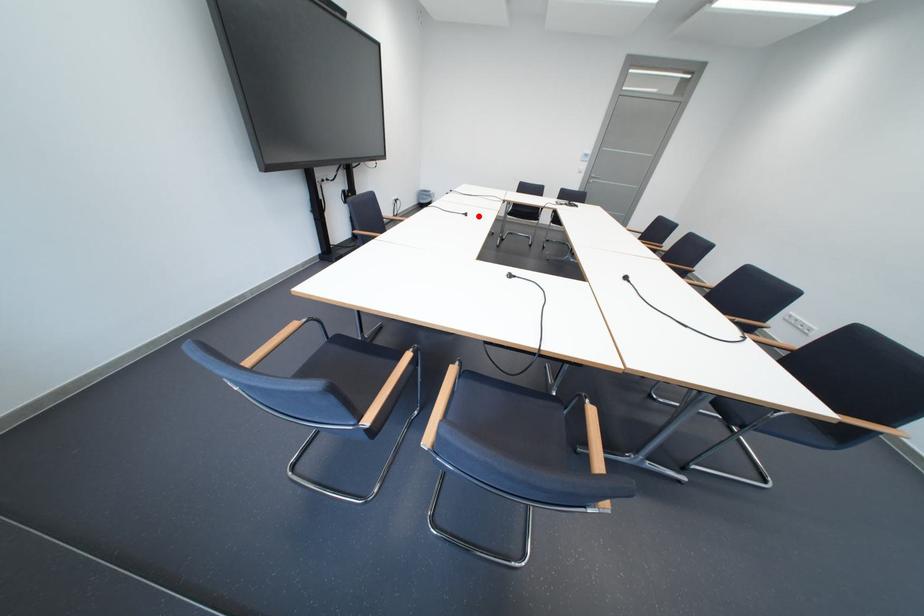
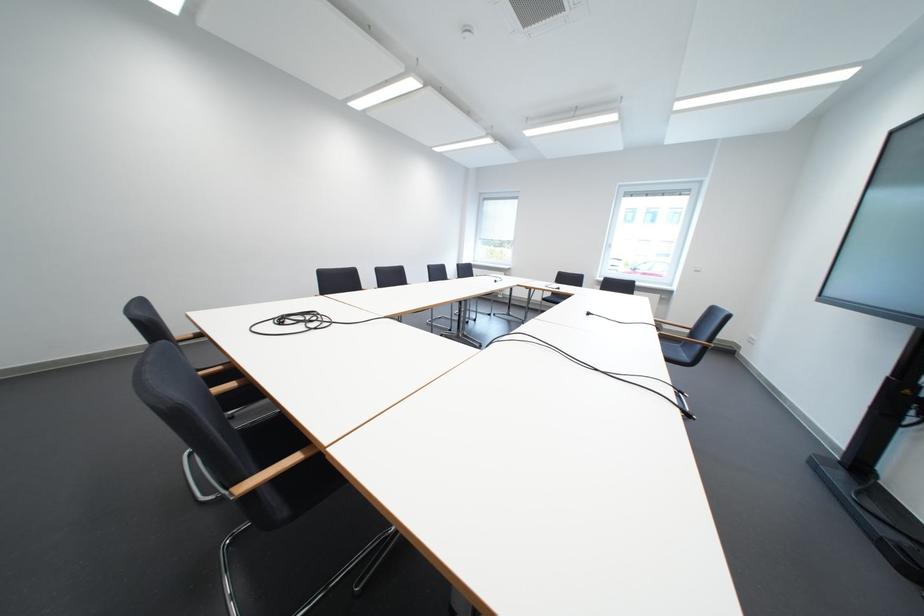
The point at the highlighted location is marked in the first image. Where is the corresponding point in the second image?

(601, 315)